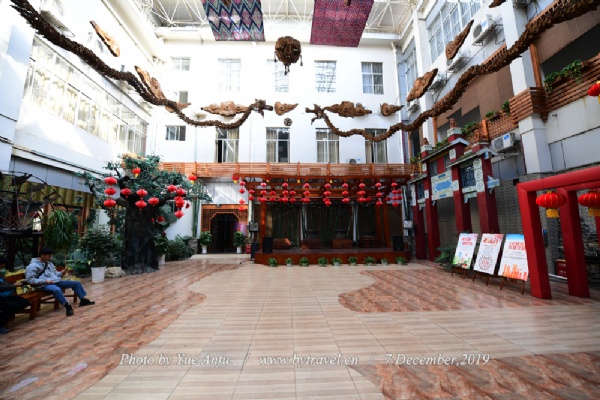
Identify the location of doorway. Image resolution: width=600 pixels, height=400 pixels. (223, 227).